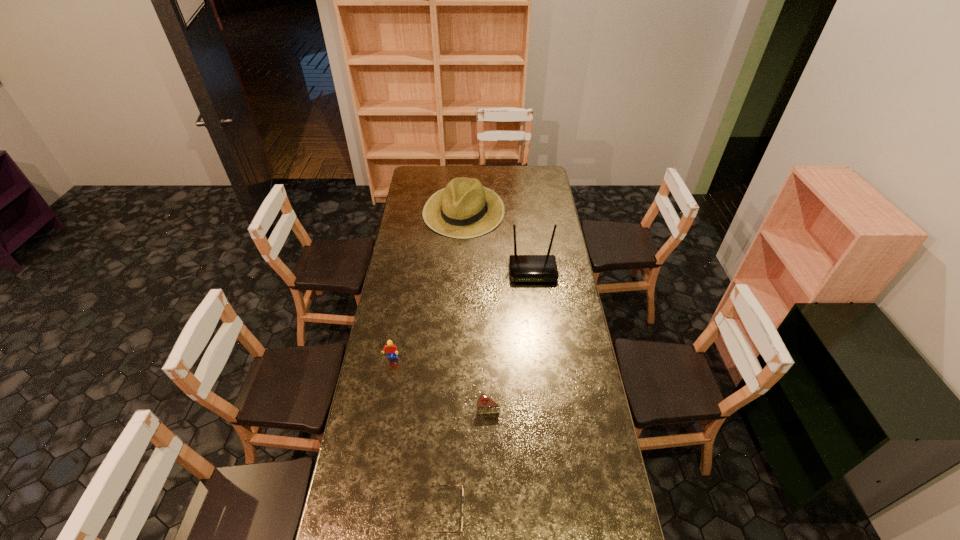
The height and width of the screenshot is (540, 960). I want to click on free point between the sunhat and the chocolate cake, so point(476,309).

In order to click on free space between the second nearest object and the nearest object in this screenshot , I will do `click(468, 460)`.

Locate an element on the screen. free point between the router and the spectacles is located at coordinates (490, 392).

Locate an element on the screen. vacant space that is in between the nearest object and the rightmost object is located at coordinates (490, 392).

Image resolution: width=960 pixels, height=540 pixels. I want to click on vacant area that lies between the second nearest object and the sunhat, so click(x=476, y=309).

This screenshot has height=540, width=960. Find the location of `unoccupied position between the fourth tallest object and the spectacles`. unoccupied position between the fourth tallest object and the spectacles is located at coordinates (468, 460).

Find the location of a particular element. free point between the router and the shortest object is located at coordinates (490, 392).

The image size is (960, 540). I want to click on free spot between the spectacles and the farthest object, so click(455, 361).

Identify the location of vacant space that is in between the rightmost object and the third tallest object. (462, 314).

The height and width of the screenshot is (540, 960). Identify the location of unoccupied area between the chocolate cake and the tallest object. (511, 339).